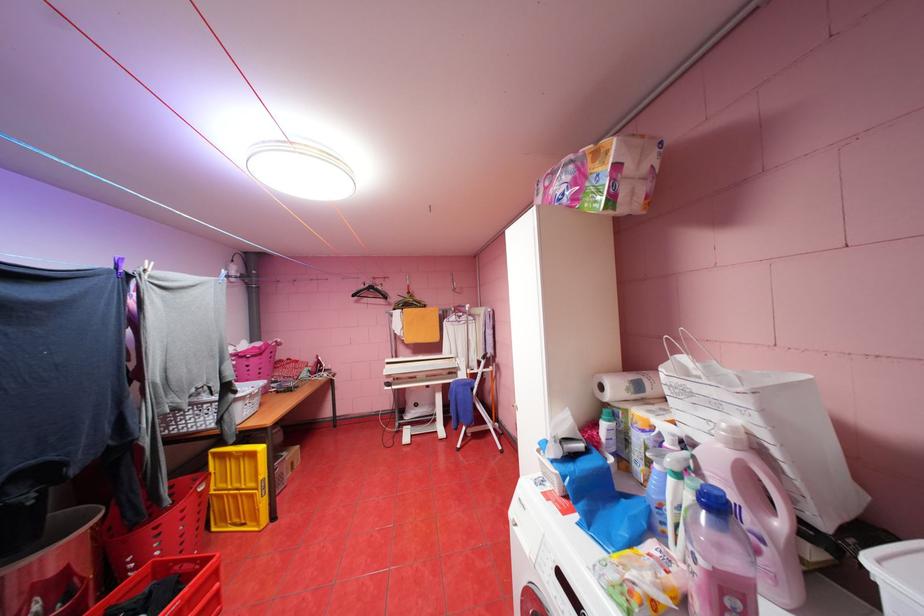
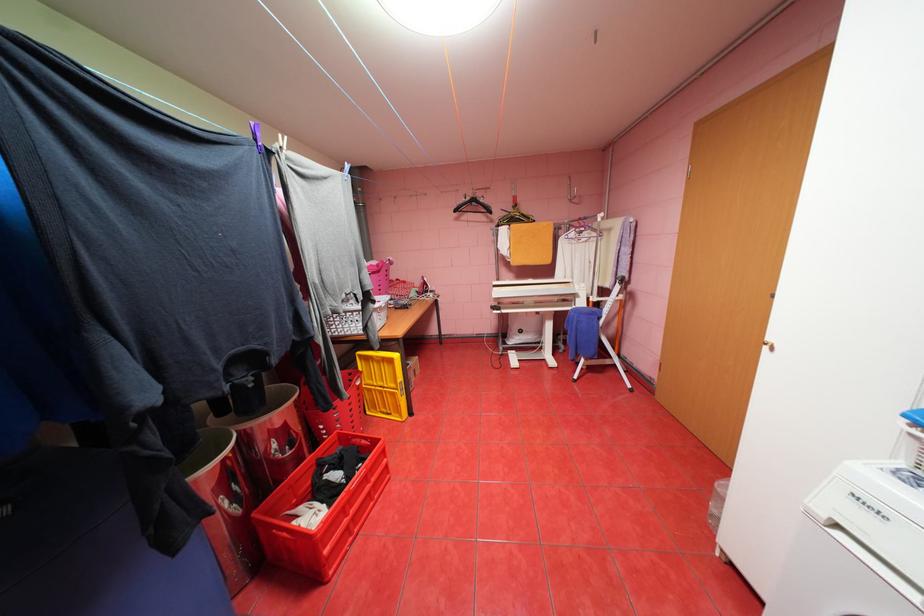
Where in the second image is the point corresponding to (x=169, y=569) from the first image?

(351, 438)